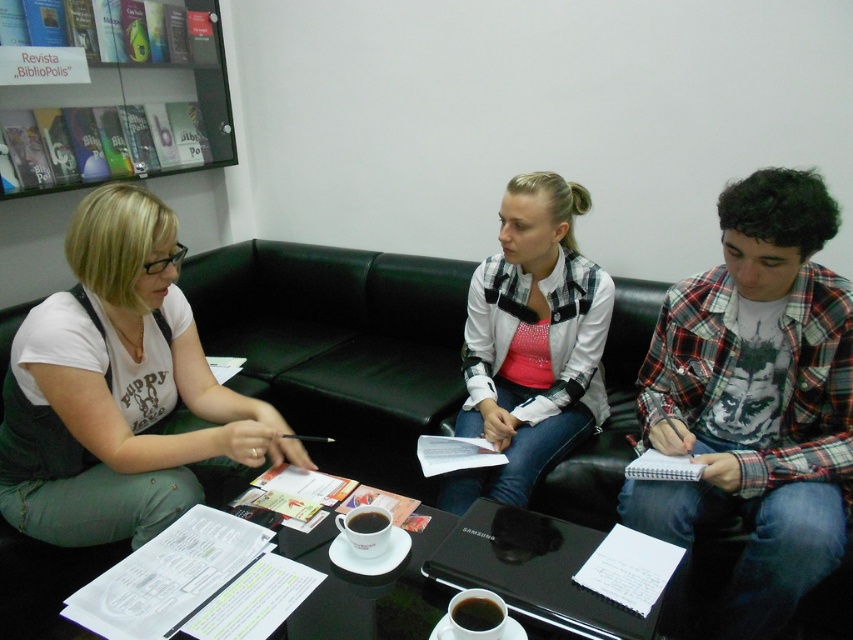
Question: Does black glossy table at lower center lie in front of black matte cup at center?

Choices:
 (A) no
 (B) yes

Answer: (B)

Question: Which point is farther to the camera?

Choices:
 (A) (234, 396)
 (B) (479, 625)

Answer: (A)

Question: Is black glossy table at lower center to the right of black glossy cup at center from the viewer's perspective?

Choices:
 (A) no
 (B) yes

Answer: (A)

Question: Can you confirm if glassy plastic bookshelf at upper left is positioned to the left of dark brown ceramic cup at center?

Choices:
 (A) no
 (B) yes

Answer: (B)

Question: Which is nearer to the dark brown ceramic cup at center?

Choices:
 (A) black glossy table at lower center
 (B) black glossy cup at center
 (C) black matte cup at center

Answer: (C)

Question: Which point is closer to the camera?

Choices:
 (A) white textured shirt at center
 (B) white matte shirt at center

Answer: (B)